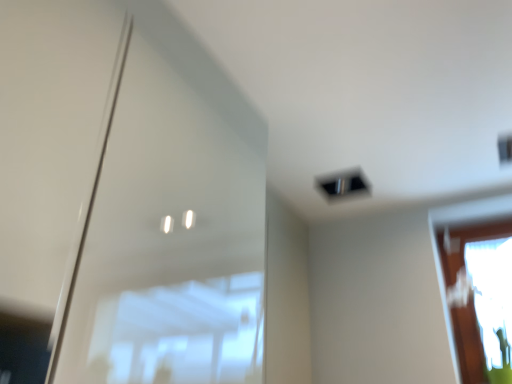
The width and height of the screenshot is (512, 384). Find the location of `transparent glass window at lower right`. transparent glass window at lower right is located at coordinates (480, 298).

The image size is (512, 384). Describe the element at coordinates (480, 298) in the screenshot. I see `transparent glass window at lower right` at that location.

Identify the location of transparent glass window at lower right. (480, 298).